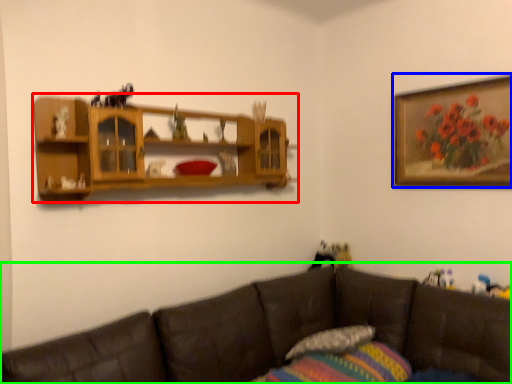
Question: Based on their relative distances, which object is nearer to shelf (highlighted by a red box)? Choose from picture frame (highlighted by a blue box) and studio couch (highlighted by a green box).

Choices:
 (A) picture frame
 (B) studio couch

Answer: (B)